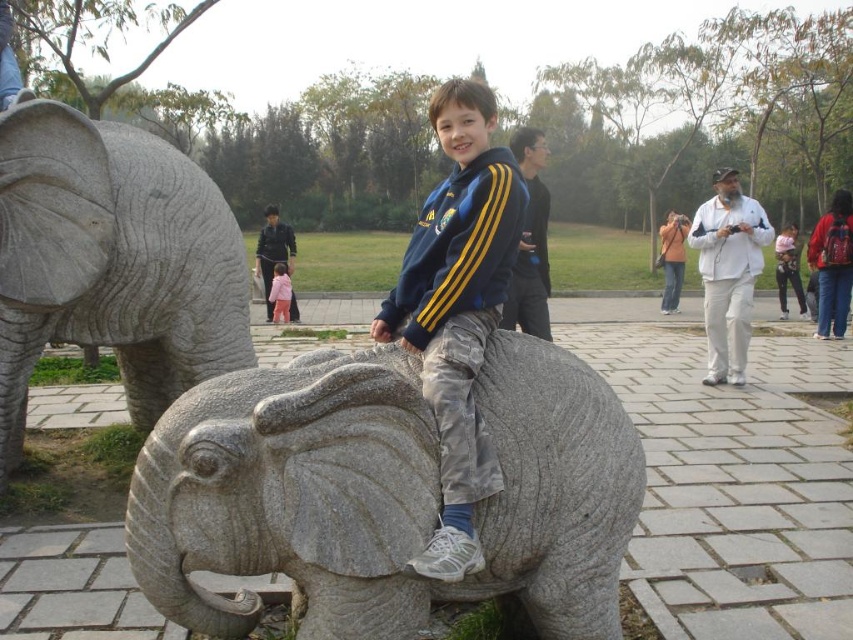
You are a parent looking for your child in the park. You see the gray stone elephant at center and the pink fabric child at center. Which one is shorter?

The gray stone elephant at center is shorter than the pink fabric child at center.

You are a park visitor who wants to take a photo of both the gray stone elephant at center and the matte gray elephant at center. However, your camera can only focus on one object at a time. Which elephant should you focus on first to ensure it appears larger in the photo?

The gray stone elephant at center is bigger than the matte gray elephant at center, so you should focus on the gray stone elephant at center first to capture its larger size in the photo.